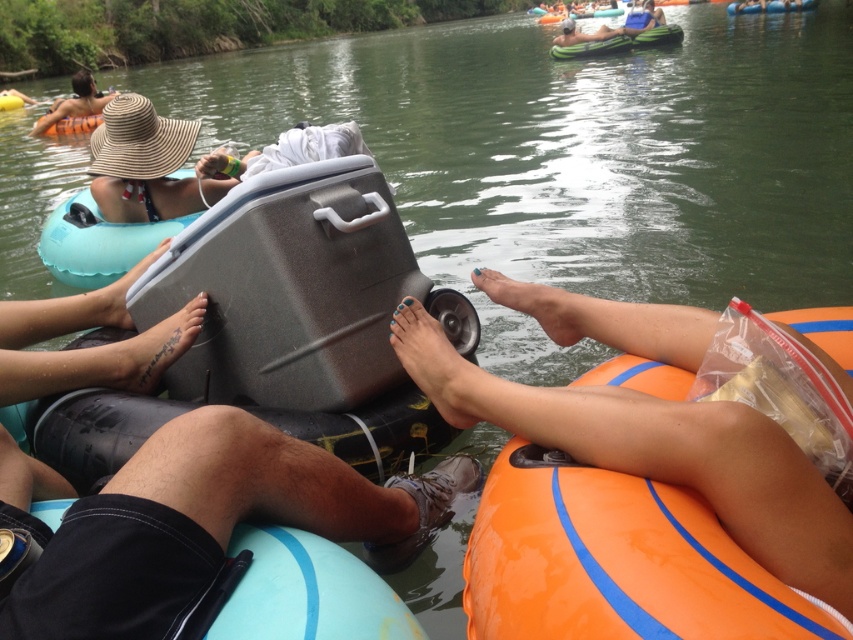
Question: Is straw hat at upper left to the right of green rubber raft at upper center from the viewer's perspective?

Choices:
 (A) no
 (B) yes

Answer: (A)

Question: Considering the real-world distances, which object is farthest from the straw hat at upper left?

Choices:
 (A) matte gray cooler at upper center
 (B) matte straw hat at upper left
 (C) matte gray cooler at upper left

Answer: (A)

Question: Does matte straw hat at upper left appear on the right side of matte gray cooler at center?

Choices:
 (A) no
 (B) yes

Answer: (A)

Question: Which point appears closest to the camera in this image?

Choices:
 (A) (126, 141)
 (B) (12, 99)
 (C) (538, 19)
 (D) (62, 547)

Answer: (D)

Question: Can you confirm if blue denim shorts at upper center is thinner than matte gray cooler at center?

Choices:
 (A) no
 (B) yes

Answer: (B)

Question: Which point is closer to the camera taking this photo?

Choices:
 (A) (759, 481)
 (B) (554, 20)
 (C) (674, 26)
 (D) (416, 378)

Answer: (A)